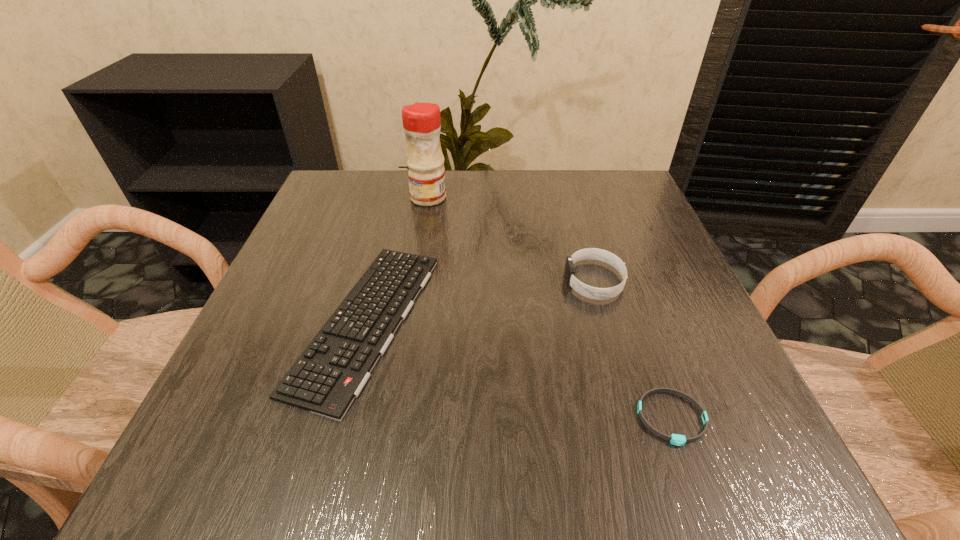
This screenshot has width=960, height=540. I want to click on vacant space located on the outer surface of the farther wristband, so click(x=492, y=281).

Identify the location of vacant space located on the right of the computer keyboard. Image resolution: width=960 pixels, height=540 pixels. (638, 321).

What are the coordinates of `object that is at the far edge` in the screenshot? It's located at (421, 121).

This screenshot has height=540, width=960. In order to click on object situated at the near edge in this screenshot , I will do `click(679, 440)`.

You are a GUI agent. You are given a task and a screenshot of the screen. Output one action in this format:
    pyautogui.click(x=<x>, y=<y>)
    Task: Click on the object at the left edge
    
    Given the screenshot: What is the action you would take?
    pyautogui.click(x=331, y=372)

The width and height of the screenshot is (960, 540). I want to click on object present at the near right corner, so click(679, 440).

Locate an element on the screen. The image size is (960, 540). vacant space at the far edge of the desktop is located at coordinates (500, 192).

I want to click on vacant space at the near edge, so click(x=428, y=441).

In the image, there is a desktop. Find the location of `vacant space at the left edge`. vacant space at the left edge is located at coordinates (333, 263).

Locate an element on the screen. Image resolution: width=960 pixels, height=540 pixels. vacant region at the right edge of the desktop is located at coordinates (628, 266).